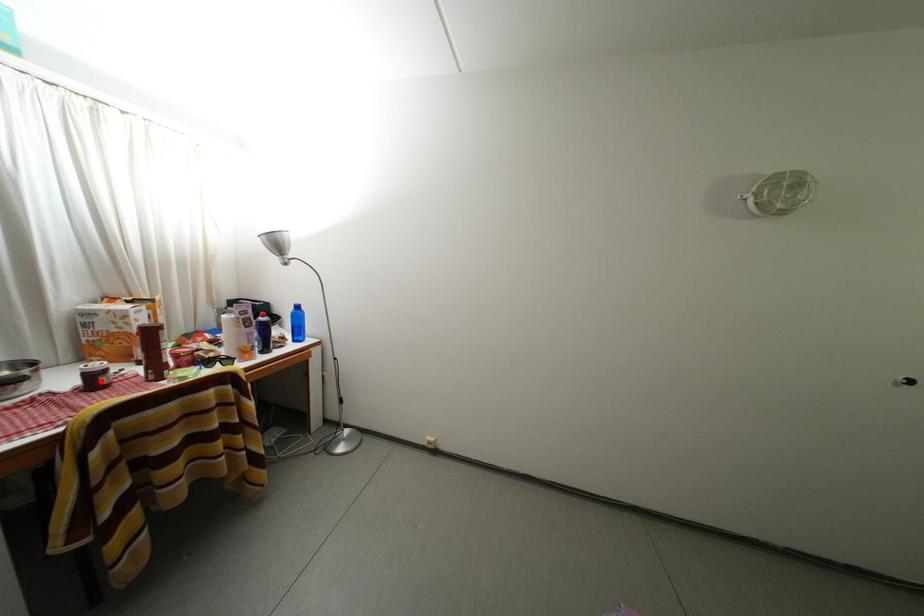
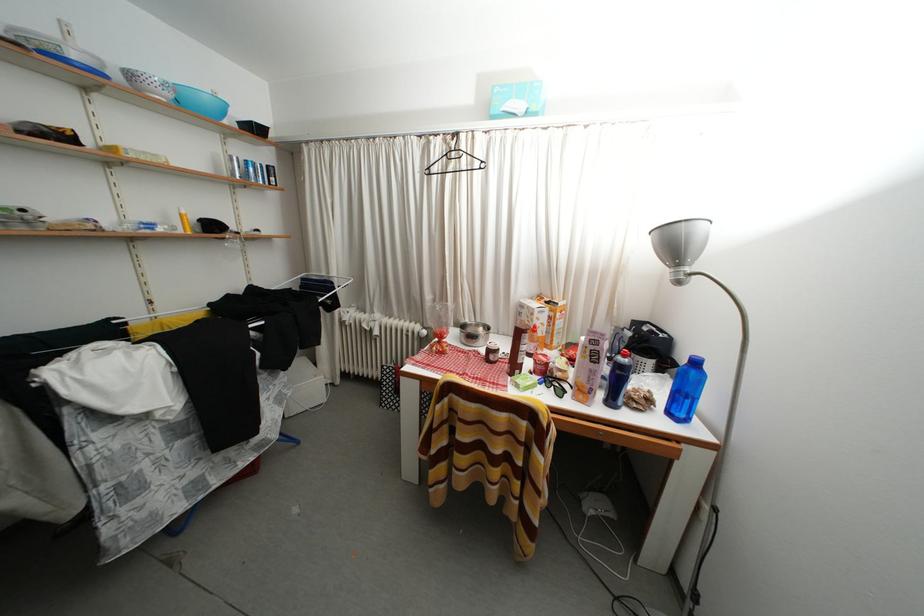
Locate, in the second image, the point that corresponds to the highlighted location in the first image.

(496, 357)